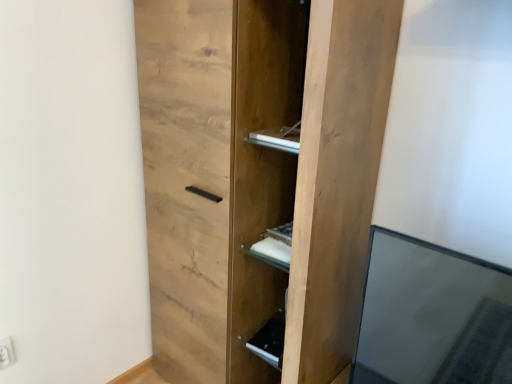
Question: Is white plastic electric outlet at lower left completely or partially outside of natural wood cupboard at center?

Choices:
 (A) yes
 (B) no

Answer: (A)

Question: Is white plastic electric outlet at lower left wider than natural wood cupboard at center?

Choices:
 (A) no
 (B) yes

Answer: (A)

Question: Are white plastic electric outlet at lower left and natural wood cupboard at center making contact?

Choices:
 (A) yes
 (B) no

Answer: (B)

Question: Would you say white plastic electric outlet at lower left is a long distance from natural wood cupboard at center?

Choices:
 (A) yes
 (B) no

Answer: (B)

Question: From the image's perspective, is white plastic electric outlet at lower left beneath natural wood cupboard at center?

Choices:
 (A) no
 (B) yes

Answer: (B)

Question: Can you confirm if white plastic electric outlet at lower left is smaller than natural wood cupboard at center?

Choices:
 (A) no
 (B) yes

Answer: (B)

Question: Is matte wood cabinet at lower center next to natural wood cupboard at center?

Choices:
 (A) no
 (B) yes

Answer: (A)

Question: From the image's perspective, is matte wood cabinet at lower center under natural wood cupboard at center?

Choices:
 (A) yes
 (B) no

Answer: (A)

Question: Can you confirm if matte wood cabinet at lower center is thinner than natural wood cupboard at center?

Choices:
 (A) yes
 (B) no

Answer: (A)

Question: Is matte wood cabinet at lower center taller than natural wood cupboard at center?

Choices:
 (A) no
 (B) yes

Answer: (A)

Question: Is natural wood cupboard at center completely or partially inside matte wood cabinet at lower center?

Choices:
 (A) no
 (B) yes

Answer: (A)

Question: From a real-world perspective, is matte wood cabinet at lower center physically above natural wood cupboard at center?

Choices:
 (A) no
 (B) yes

Answer: (A)

Question: Is natural wood cupboard at center to the right of white plastic electric outlet at lower left from the viewer's perspective?

Choices:
 (A) no
 (B) yes

Answer: (B)